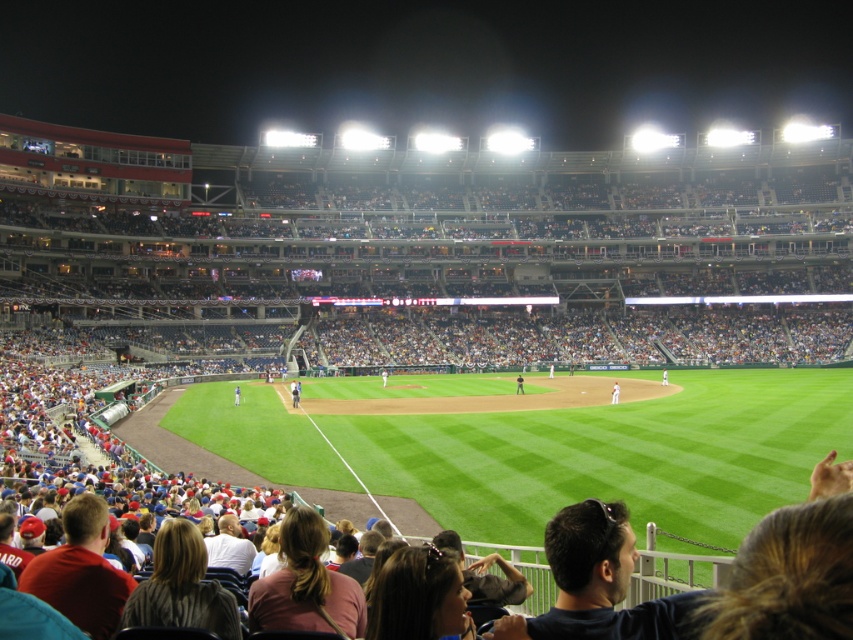
Who is more forward, (612, 397) or (238, 403)?

Positioned in front is point (612, 397).

Between white uniformed player at center and blue uniformed player at center, which one is positioned lower?

blue uniformed player at center

Where is `white uniformed player at center`? The image size is (853, 640). white uniformed player at center is located at coordinates (614, 392).

Does white jersey at center appear under white uniformed player at center?

Correct, white jersey at center is located below white uniformed player at center.

Is white jersey at center thinner than white uniformed player at center?

In fact, white jersey at center might be wider than white uniformed player at center.

Is point (294, 397) more distant than point (616, 387)?

No.

Locate an element on the screen. white jersey at center is located at coordinates (294, 394).

Is white jersey at center smaller than white uniformed person at center?

No.

Between white jersey at center and white uniformed person at center, which one appears on the left side from the viewer's perspective?

white jersey at center is more to the left.

Image resolution: width=853 pixels, height=640 pixels. What do you see at coordinates (294, 394) in the screenshot? I see `white jersey at center` at bounding box center [294, 394].

Where is `white jersey at center`? The width and height of the screenshot is (853, 640). white jersey at center is located at coordinates (294, 394).